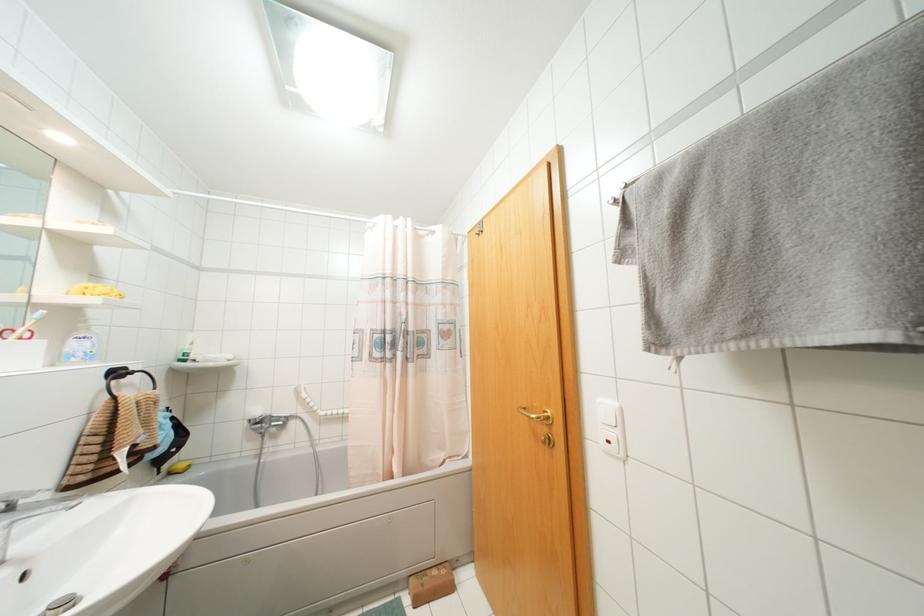
Locate an element on the screen. The width and height of the screenshot is (924, 616). faucet handle is located at coordinates (18, 496).